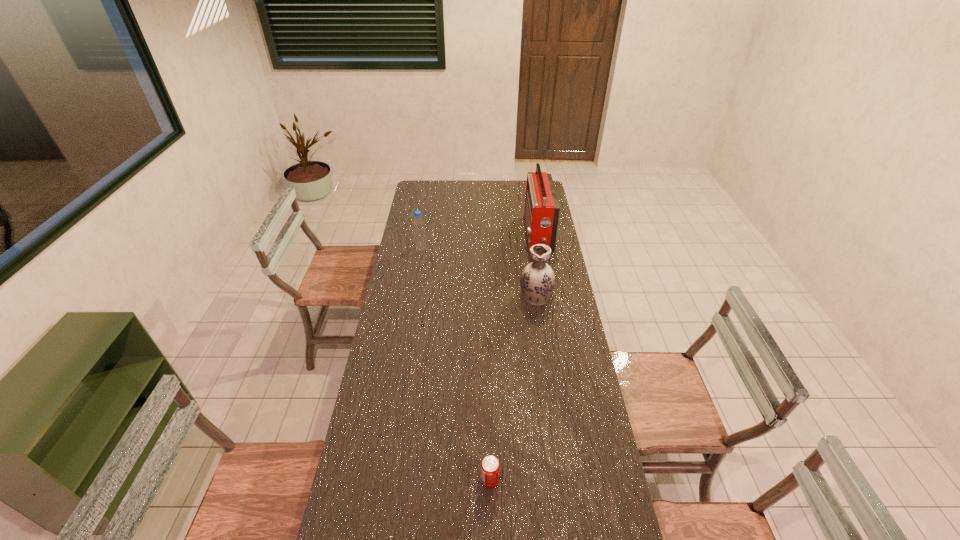
Find the location of `radio receiver`. radio receiver is located at coordinates pos(541,214).

This screenshot has width=960, height=540. In order to click on vase in this screenshot , I will do `click(537, 281)`.

This screenshot has width=960, height=540. I want to click on the second nearest object, so click(x=537, y=281).

At what (x,y) coordinates should I click in order to perform the action: click on water bottle. Please return your answer as a coordinate pair (x, y). The width and height of the screenshot is (960, 540). Looking at the image, I should click on (418, 223).

I want to click on the third tallest object, so click(418, 223).

Find the location of `the nearest object`. the nearest object is located at coordinates (490, 467).

Find the location of a particular element. This screenshot has width=960, height=540. the second object from left to right is located at coordinates (490, 467).

What are the coordinates of `free location located 0.170m on the front-facing side of the tallest object` in the screenshot? It's located at 492,235.

Locate an element on the screen. vacant area situated 0.160m on the front-facing side of the tallest object is located at coordinates (493, 235).

Identify the location of vacant space located 0.200m on the front-facing side of the tallest object. (486, 235).